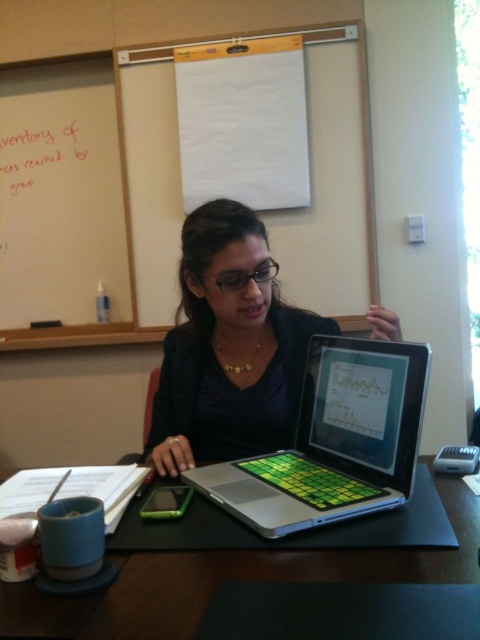
You are a student who needs to present your findings using the whiteboard at upper left. To do so, you need to move your green matte laptop at center out of the way. Is the laptop currently blocking the whiteboard?

The green matte laptop at center is positioned under the whiteboard at upper left, so it is not blocking the whiteboard. You can move the laptop to the side if needed, but it is already clear.

You are standing in front of the desk in the classroom and need to place a new item exactly where the green matte laptop at center is currently located. What are the coordinates of the spot where you should place the new item?

The coordinates for the spot where the green matte laptop at center is located are at point (334, 442).